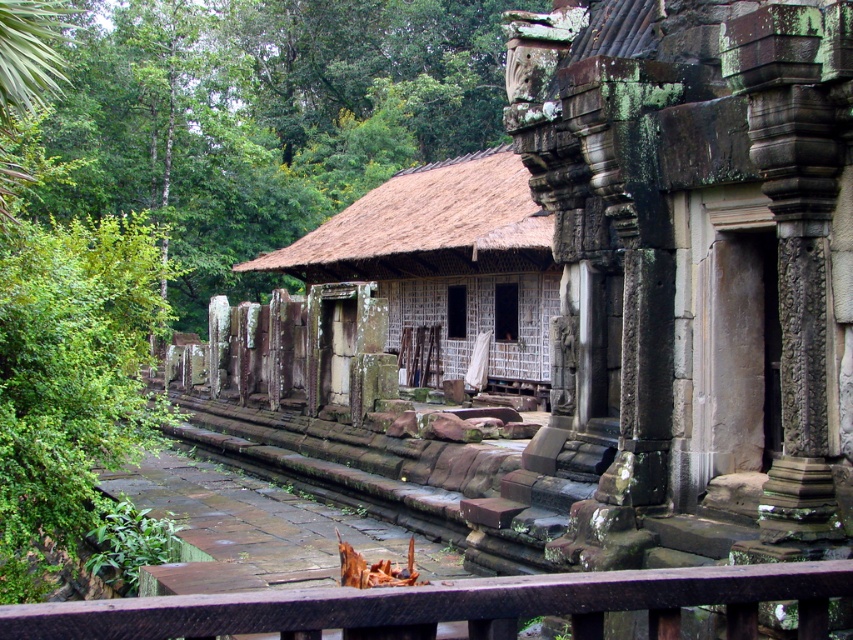
Is thatched straw hut at center closer to the viewer compared to brown wooden rail at lower center?

No, thatched straw hut at center is behind brown wooden rail at lower center.

Measure the distance between thatched straw hut at center and camera.

A distance of 77.78 feet exists between thatched straw hut at center and camera.

I want to click on thatched straw hut at center, so click(445, 266).

Does green leafy vegetation at center appear on the left side of brown wooden rail at lower center?

Correct, you'll find green leafy vegetation at center to the left of brown wooden rail at lower center.

Where is `green leafy vegetation at center`? green leafy vegetation at center is located at coordinates (258, 118).

Is green leafy vegetation at center positioned before thatched straw hut at center?

Yes, green leafy vegetation at center is in front of thatched straw hut at center.

Who is shorter, green leafy vegetation at center or thatched straw hut at center?

Standing shorter between the two is thatched straw hut at center.

Who is more forward, (x=148, y=138) or (x=363, y=259)?

Point (x=363, y=259)

Locate an element on the screen. This screenshot has height=640, width=853. green leafy vegetation at center is located at coordinates (258, 118).